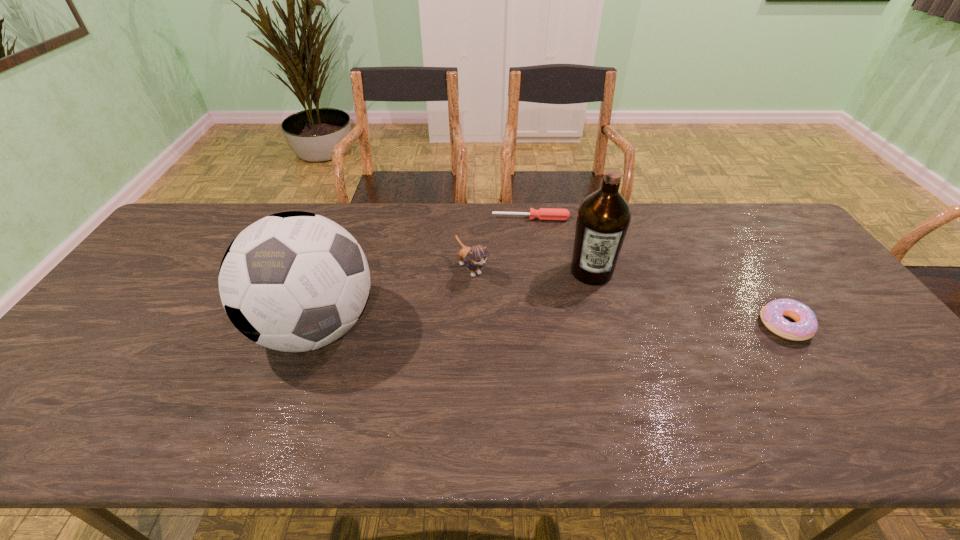
The height and width of the screenshot is (540, 960). I want to click on object at the right edge, so click(806, 325).

The image size is (960, 540). I want to click on free space at the far edge, so click(x=367, y=215).

The image size is (960, 540). In the image, there is a desktop. In order to click on blank space at the near edge in this screenshot , I will do `click(299, 395)`.

Find the location of a particular element. The width and height of the screenshot is (960, 540). vacant space at the left edge of the desktop is located at coordinates (110, 353).

In the image, there is a desktop. Where is `vacant region at the right edge`? Image resolution: width=960 pixels, height=540 pixels. vacant region at the right edge is located at coordinates (828, 307).

Where is `vacant area at the far left corner of the desktop`? Image resolution: width=960 pixels, height=540 pixels. vacant area at the far left corner of the desktop is located at coordinates (201, 241).

This screenshot has width=960, height=540. In order to click on free space between the olive oil and the shortest object in this screenshot , I will do `click(561, 245)`.

You are a GUI agent. You are given a task and a screenshot of the screen. Output one action in this format:
    pyautogui.click(x=<x>, y=<y>)
    Task: Click on the free space between the leftmost object and the doughnut
    This screenshot has width=960, height=540.
    Given the screenshot: What is the action you would take?
    pyautogui.click(x=550, y=326)

Locate an element on the screen. Image resolution: width=960 pixels, height=540 pixels. blank region between the olive oil and the doughnut is located at coordinates (687, 298).

Where is `free space that is in between the rightmost object and the soccer ball`? This screenshot has width=960, height=540. free space that is in between the rightmost object and the soccer ball is located at coordinates (550, 326).